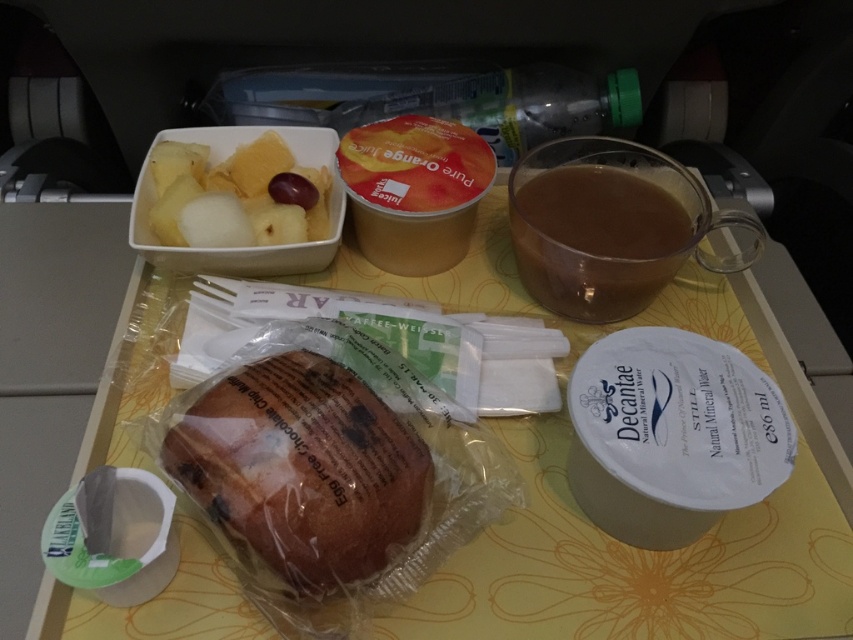
You are a flight attendant carrying a meal tray. You need to place a 6.5 inch long spoon between the white paper cup at upper center and the brown translucent glass at upper right. Is there enough space?

The distance between the white paper cup at upper center and the brown translucent glass at upper right is 5.90 inches. Since the spoon is 6.5 inches long, it would not fit between them as the available space is shorter than the spoon.

You are an airplane passenger sitting at the meal tray. You want to reach for the item located at point [579,209] and the item at point [306,234]. Which item is closer to you?

Point [579,209] is behind point [306,234], so the item at point [306,234] is closer to you.